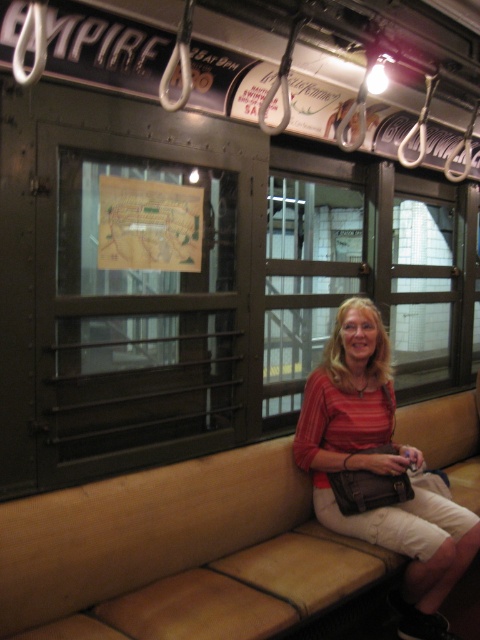
You are a passenger in the subway car and want to place your matte red blouse at center on the beige leather couch at center. Is there enough space for the blouse?

The beige leather couch at center is 17.36 inches from matte red blouse at center, so there is sufficient space to place the matte red blouse at center on the beige leather couch at center.

Consider the image. You are a passenger sitting at the point with coordinates (178, 554) in the subway car. What object are you sitting on?

The point at coordinates (178, 554) corresponds to the beige leather couch at center, so you are sitting on the beige leather couch at center.

You are a passenger sitting on the beige leather couch at center in the subway car. You want to hand a book to the person wearing the matte red blouse at center. In which direction should you pass the book?

You should pass the book to the right, since the beige leather couch at center is to the left of the matte red blouse at center.